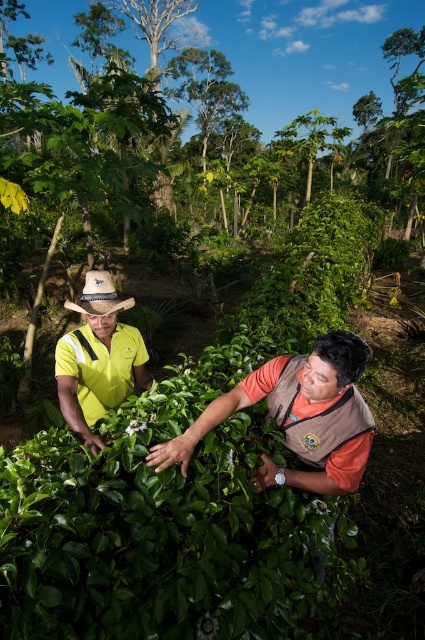
In the scene shown: You are planning to install a solar panel between the green leafy tree at upper center and the brown vest at center. The solar panel requires a minimum distance of 40 meters between the two points for proper installation. Can you install it in this location?

The green leafy tree at upper center and brown vest at center are 39.62 meters apart, which is less than the required 40 meters. Therefore, the solar panel cannot be installed in this location.

You are a visitor in the garden and want to take a photo of the brown vest at center and the yellow fabric shirt at left. Which one should you focus on first if you want to capture both clearly in the same frame?

The brown vest at center is in front of the yellow fabric shirt at left, so you should focus on the brown vest at center first to ensure both are in focus.

You are standing at the base of the green leafy tree at upper center and want to throw a ball to a friend who is 20 meters away from you. Can you reach your friend with one throw?

The distance between you and your friend is 20 meters, which is slightly less than the 20.95 meters between the green leafy tree at upper center and the viewer. Assuming an average throw distance of around 20 meters, you might be able to reach your friend with a strong throw, but it could be challenging due to the slight difference in distance.